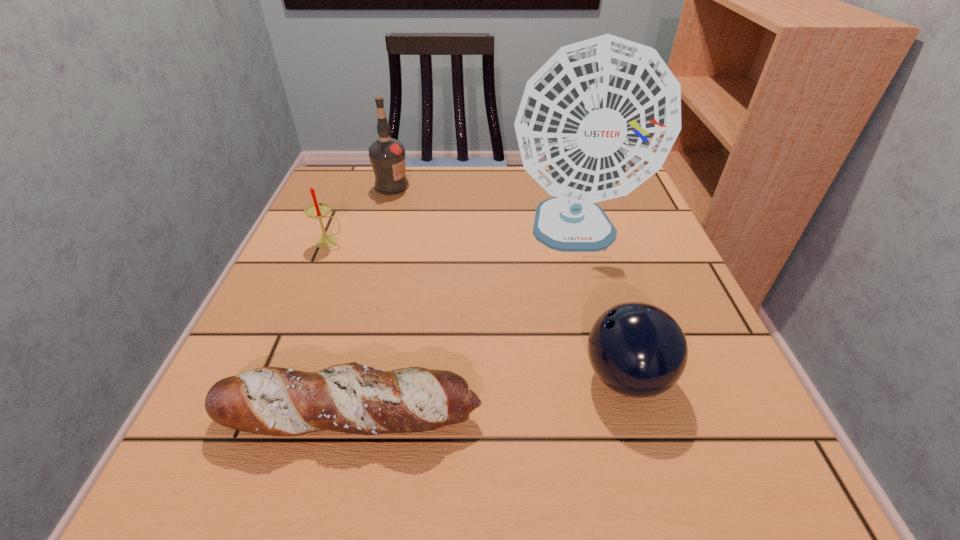
This screenshot has height=540, width=960. I want to click on bowling ball that is at the right edge, so click(x=637, y=349).

Where is `object present at the far left corner`? object present at the far left corner is located at coordinates (387, 155).

Find the location of a particular element. object located at the near left corner is located at coordinates (351, 398).

Find the location of a particular element. The height and width of the screenshot is (540, 960). object that is at the far right corner is located at coordinates (600, 117).

Locate an element on the screen. vacant space at the far edge of the desktop is located at coordinates (457, 199).

At what (x,y) coordinates should I click in order to perform the action: click on free space at the near edge of the desktop. Please return your answer as a coordinate pair (x, y). The height and width of the screenshot is (540, 960). Looking at the image, I should click on (611, 446).

Locate an element on the screen. The height and width of the screenshot is (540, 960). vacant region at the left edge of the desktop is located at coordinates (378, 227).

The width and height of the screenshot is (960, 540). Identify the location of blank space at the right edge of the desktop. (623, 220).

I want to click on vacant space at the far left corner of the desktop, so click(360, 218).

At what (x,y) coordinates should I click in order to perform the action: click on free space at the near left corner. Please return your answer as a coordinate pair (x, y). Looking at the image, I should click on (241, 446).